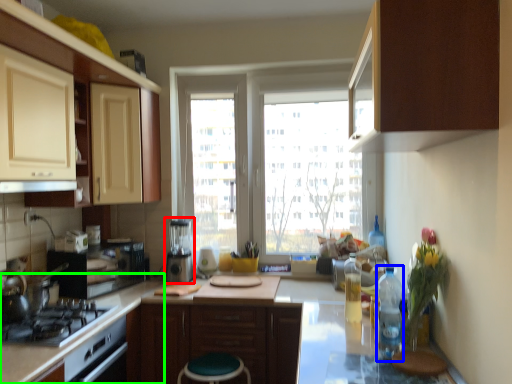
Question: Considering the real-world distances, which object is farthest from appliance (highlighted by a red box)? bottle (highlighted by a blue box) or counter top (highlighted by a green box)?

Choices:
 (A) bottle
 (B) counter top

Answer: (A)